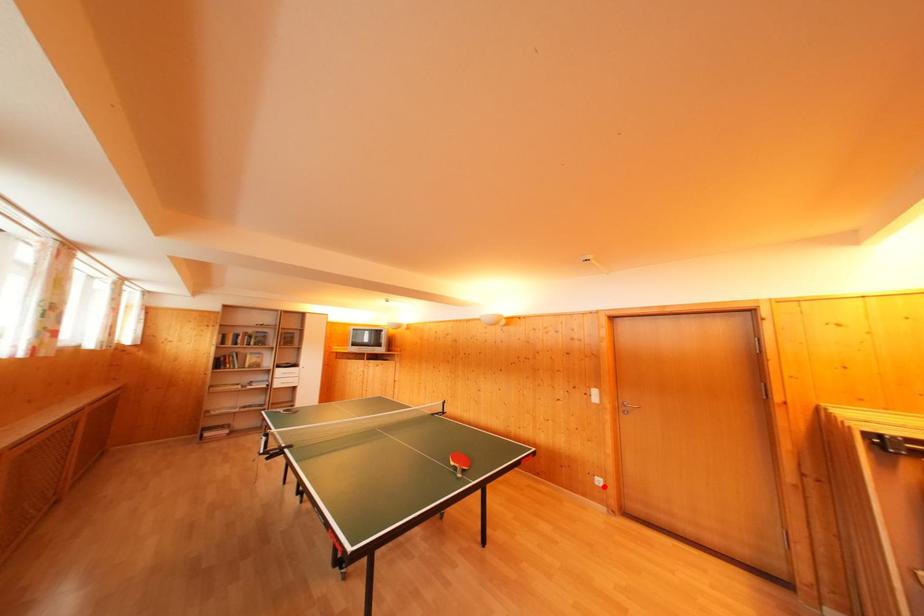
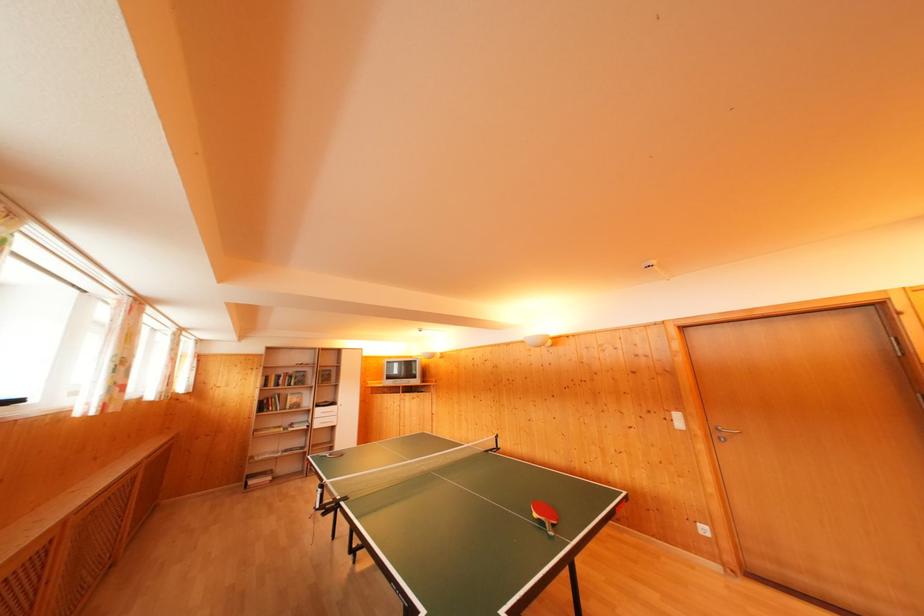
Question: I am providing you with two images of the same scene from different viewpoints. In image1, a red point is highlighted. Considering the same 3D point in image2, which of the following is correct?

Choices:
 (A) It is closer
 (B) It is farther

Answer: (A)